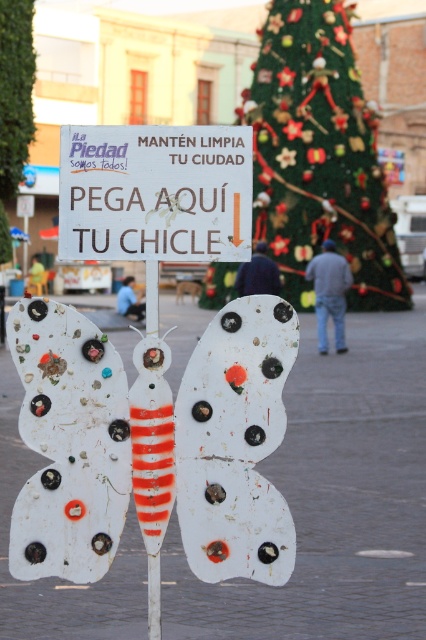
Can you confirm if white plastic butterfly at center is positioned to the left of white matte sign at center?

Indeed, white plastic butterfly at center is positioned on the left side of white matte sign at center.

Is white plastic butterfly at center shorter than white matte sign at center?

No.

Does point (112, 550) lie in front of point (109, 136)?

No, (112, 550) is behind (109, 136).

Find the location of `white plastic butterfly at center`. white plastic butterfly at center is located at coordinates (69, 444).

Does white matte butterfly at center appear under white matte sign at center?

Yes.

Between white matte butterfly at center and white matte sign at center, which one appears on the right side from the viewer's perspective?

white matte butterfly at center

Where is `white matte butterfly at center`? The height and width of the screenshot is (640, 426). white matte butterfly at center is located at coordinates point(236,444).

Does green textured christmas tree at center appear on the right side of white matte sign at center?

Indeed, green textured christmas tree at center is positioned on the right side of white matte sign at center.

Does green textured christmas tree at center have a smaller size compared to white matte sign at center?

No, green textured christmas tree at center is not smaller than white matte sign at center.

Which is behind, point (270, 161) or point (137, 246)?

The point (270, 161) is more distant.

The height and width of the screenshot is (640, 426). What are the coordinates of `green textured christmas tree at center` in the screenshot? It's located at (319, 156).